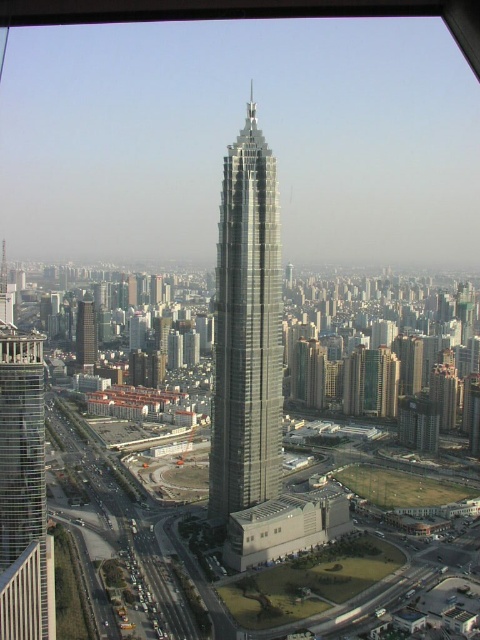
You are an architect reviewing the city layout. You notice the smooth glass skyscraper at center and the transparent glass window at center. Which one is closer to the viewer?

The smooth glass skyscraper at center is positioned over the transparent glass window at center, meaning it is closer to the viewer.

You are standing at point A with coordinates point A at (x=228, y=161). You want to walk to point B which is 910.98 feet away. Is this distance longer than a football field?

The distance between point A at (x=228, y=161) and point B is 910.98 feet. A standard football field is 300 feet long, so yes, the distance is longer than a football field.

You are an architect evaluating the urban layout. Considering the silver glass skyscraper at center and the transparent glass window at center, which one has a greater width?

The silver glass skyscraper at center has a greater width than the transparent glass window at center according to the description.